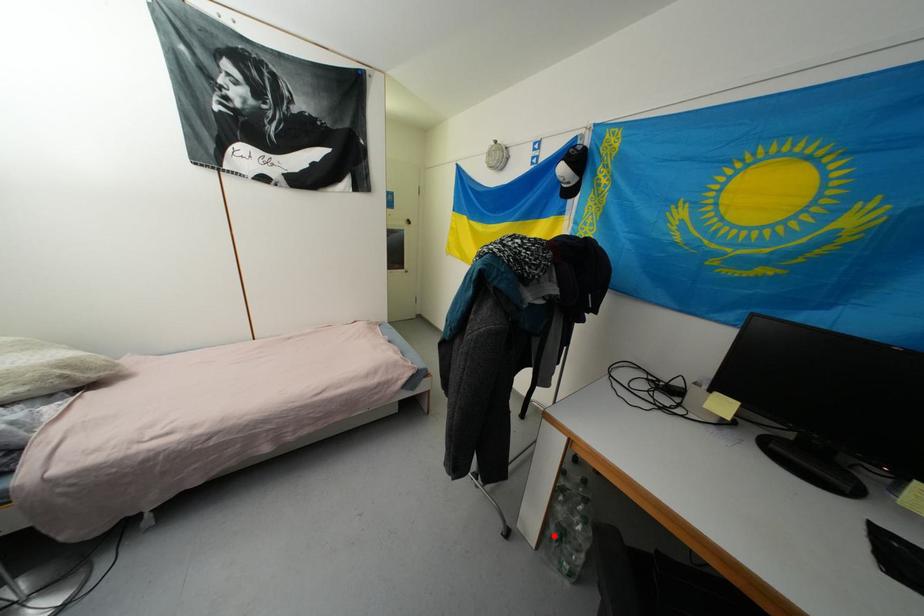
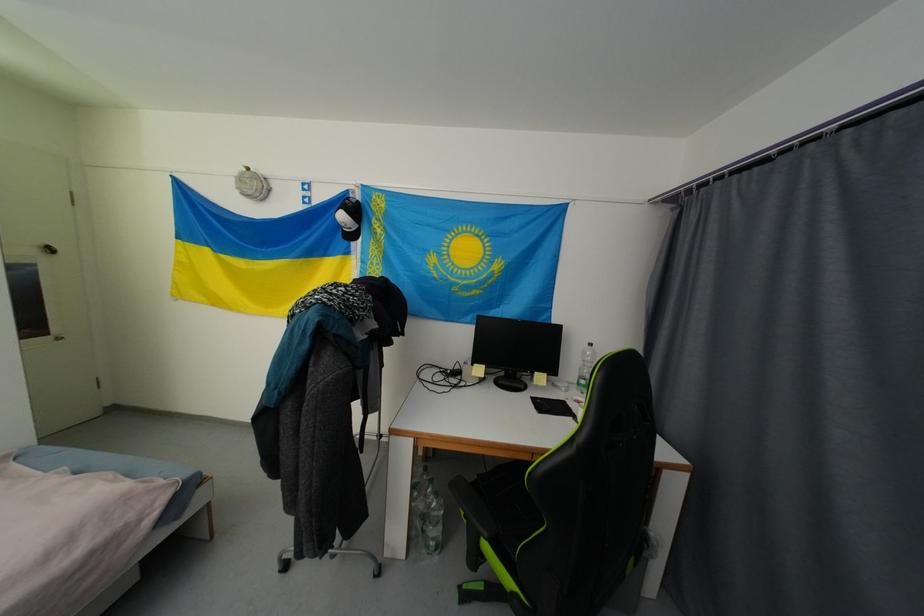
Where in the second image is the point corresponding to the highlighted location from the first image?

(419, 535)